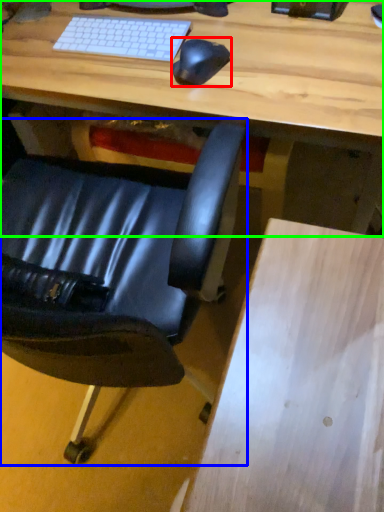
Question: Which object is positioned closest to mouse (highlighted by a red box)? Select from chair (highlighted by a blue box) and desk (highlighted by a green box).

Choices:
 (A) chair
 (B) desk

Answer: (B)